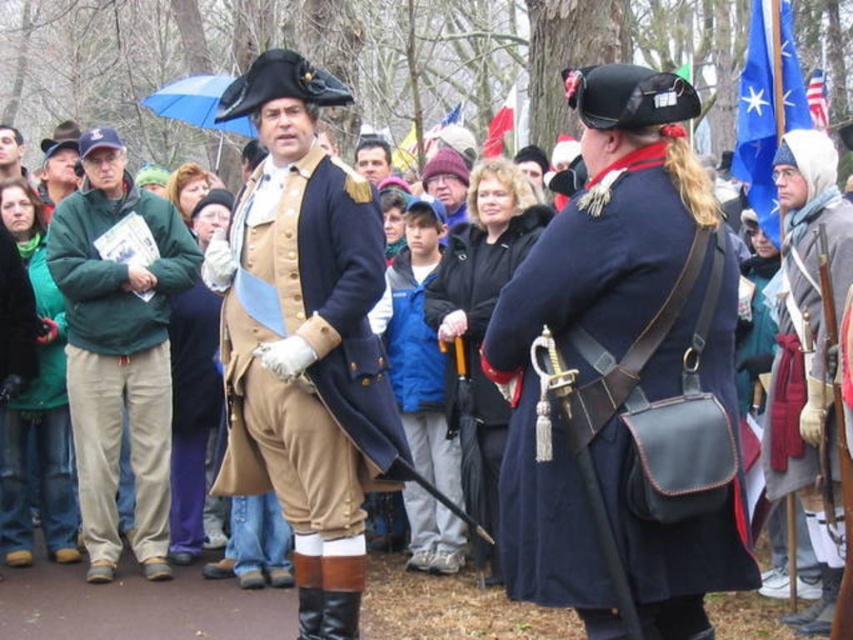
Does green fleece jacket at left have a larger size compared to dark blue leather coat at center?

Yes, green fleece jacket at left is bigger than dark blue leather coat at center.

The width and height of the screenshot is (853, 640). What do you see at coordinates (119, 346) in the screenshot?
I see `green fleece jacket at left` at bounding box center [119, 346].

Who is more forward, (167, 513) or (426, 317)?

Point (167, 513) is more forward.

Find the location of `green fleece jacket at left`. green fleece jacket at left is located at coordinates tap(119, 346).

Based on the photo, between matte gold uniform at center and blue fabric jacket at center, which one is positioned lower?

blue fabric jacket at center is lower down.

Does matte gold uniform at center have a greater width compared to blue fabric jacket at center?

Correct, the width of matte gold uniform at center exceeds that of blue fabric jacket at center.

Where is `matte gold uniform at center`? This screenshot has width=853, height=640. matte gold uniform at center is located at coordinates (305, 339).

Is green fleece jacket at left positioned at the back of blue fabric jacket at center?

That is False.

Can you confirm if green fleece jacket at left is positioned to the left of blue fabric jacket at center?

Yes, green fleece jacket at left is to the left of blue fabric jacket at center.

This screenshot has height=640, width=853. I want to click on green fleece jacket at left, so click(119, 346).

The image size is (853, 640). Find the location of `green fleece jacket at left`. green fleece jacket at left is located at coordinates pos(119,346).